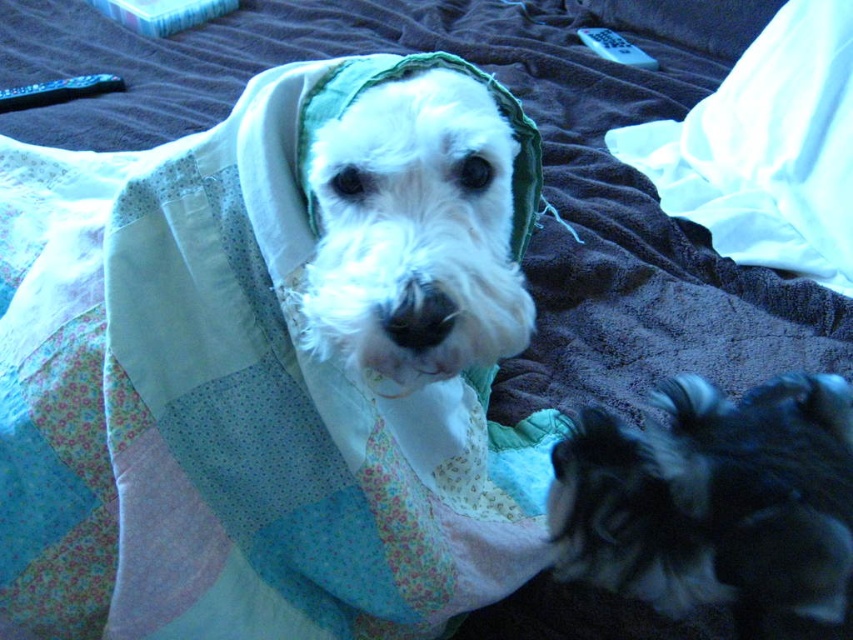
Question: Which point appears closest to the camera in this image?

Choices:
 (A) (672, 580)
 (B) (718, 134)
 (C) (405, 336)

Answer: (C)

Question: Which is nearer to the white satin pillow at upper right?

Choices:
 (A) black fluffy dog at lower right
 (B) white fluffy dog at center

Answer: (A)

Question: Does black fluffy dog at lower right have a lesser width compared to white fluffy dog at center?

Choices:
 (A) yes
 (B) no

Answer: (B)

Question: From the image, what is the correct spatial relationship of black fluffy dog at lower right in relation to white satin pillow at upper right?

Choices:
 (A) above
 (B) below

Answer: (B)

Question: Estimate the real-world distances between objects in this image. Which object is farther from the white satin pillow at upper right?

Choices:
 (A) black fluffy dog at lower right
 (B) white fluffy dog at center

Answer: (B)

Question: Does white fluffy dog at center appear on the left side of white satin pillow at upper right?

Choices:
 (A) yes
 (B) no

Answer: (A)